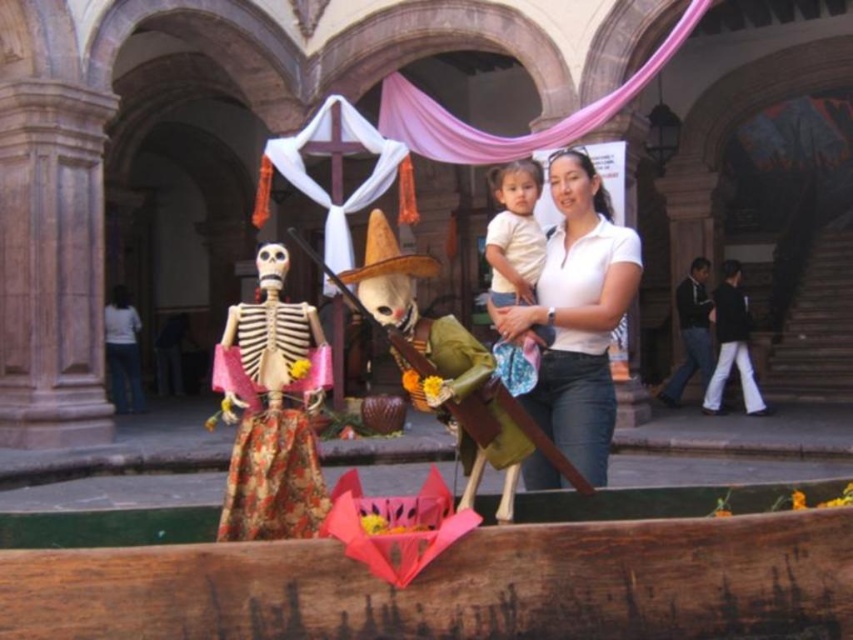
Question: Which point appears farthest from the camera in this image?

Choices:
 (A) (305, 445)
 (B) (491, 291)

Answer: (B)

Question: Among these objects, which one is farthest from the camera?

Choices:
 (A) matte painted wooden skeleton at left
 (B) white matte shirt at center

Answer: (B)

Question: Does matte painted wooden skeleton at left have a larger size compared to matte white shirt at center?

Choices:
 (A) yes
 (B) no

Answer: (B)

Question: Can you confirm if white matte shirt at center is positioned below matte white shirt at center?

Choices:
 (A) yes
 (B) no

Answer: (A)

Question: Which point appears closest to the camera in this image?

Choices:
 (A) (514, 230)
 (B) (612, 433)
 (C) (289, 445)

Answer: (C)

Question: Does white matte shirt at center have a greater width compared to matte painted wooden skeleton at left?

Choices:
 (A) yes
 (B) no

Answer: (B)